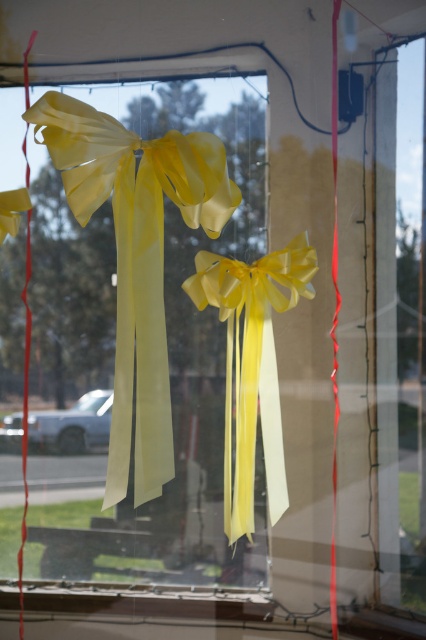
You are an interior designer planning to replace the translucent yellow ribbon at center and the transparent plastic ribbon at right with new ones. If you want to maintain the current size relationship between them, which ribbon should you choose to be bigger?

The translucent yellow ribbon at center should be bigger than the transparent plastic ribbon at right to maintain the current size relationship between them.

You are hanging decorations for a party and need to know the position of the translucent yellow ribbon at center and the transparent plastic ribbon at right. Which ribbon is higher up?

The translucent yellow ribbon at center is higher up than the transparent plastic ribbon at right.